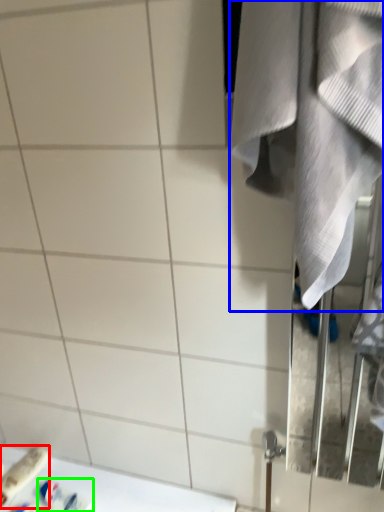
Question: Which object is the farthest from toiletry (highlighted by a red box)? Choose among these: towel (highlighted by a blue box) or toiletry (highlighted by a green box).

Choices:
 (A) towel
 (B) toiletry

Answer: (A)